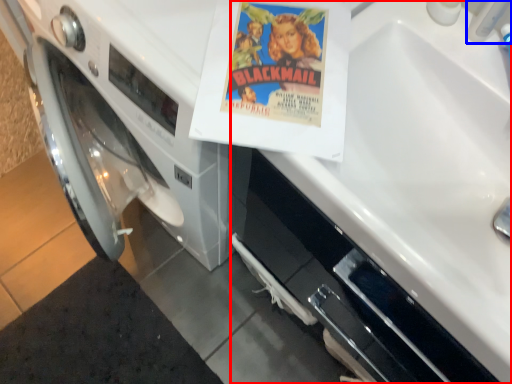
Question: Which object is further to the camera taking this photo, sink (highlighted by a red box) or faucet (highlighted by a blue box)?

Choices:
 (A) sink
 (B) faucet

Answer: (B)